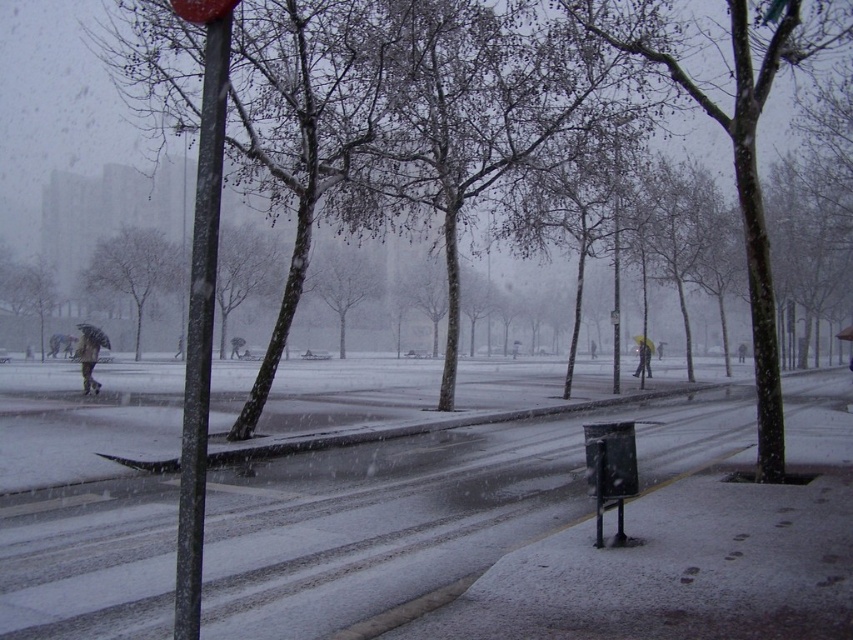
Question: Which point is farther to the camera?

Choices:
 (A) raincoat fabric person at center
 (B) brown leather coat at left
 (C) metallic bus stop at lower right
 (D) snow-covered concrete at lower left

Answer: (A)

Question: Among these points, which one is farthest from the camera?

Choices:
 (A) (601, 458)
 (B) (166, 269)
 (C) (202, 285)
 (D) (126, 509)

Answer: (B)

Question: Is metallic pole at left to the right of raincoat fabric person at center from the viewer's perspective?

Choices:
 (A) no
 (B) yes

Answer: (A)

Question: Considering the relative positions of metallic pole at left and raincoat fabric person at center in the image provided, where is metallic pole at left located with respect to raincoat fabric person at center?

Choices:
 (A) left
 (B) right

Answer: (A)

Question: Is metallic bus stop at lower right wider than brown leather coat at left?

Choices:
 (A) no
 (B) yes

Answer: (A)

Question: Estimate the real-world distances between objects in this image. Which object is farther from the raincoat fabric person at center?

Choices:
 (A) metallic bus stop at lower right
 (B) smooth gray tree at center

Answer: (A)